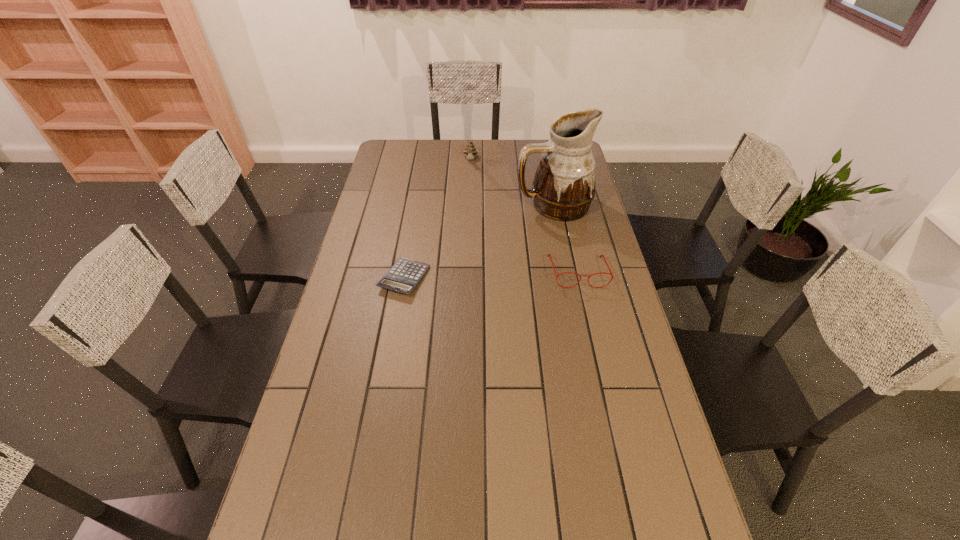
I want to click on free space on the desktop that is between the shortest object and the spectacles and is positioned from the spout of the second farthest object, so click(x=474, y=276).

You are a GUI agent. You are given a task and a screenshot of the screen. Output one action in this format:
    pyautogui.click(x=<x>, y=<y>)
    Task: Click on the vacant space on the desktop that is between the leftmost object and the second shortest object and is positioned on the face of the second object from left to right
    
    Given the screenshot: What is the action you would take?
    pyautogui.click(x=467, y=276)